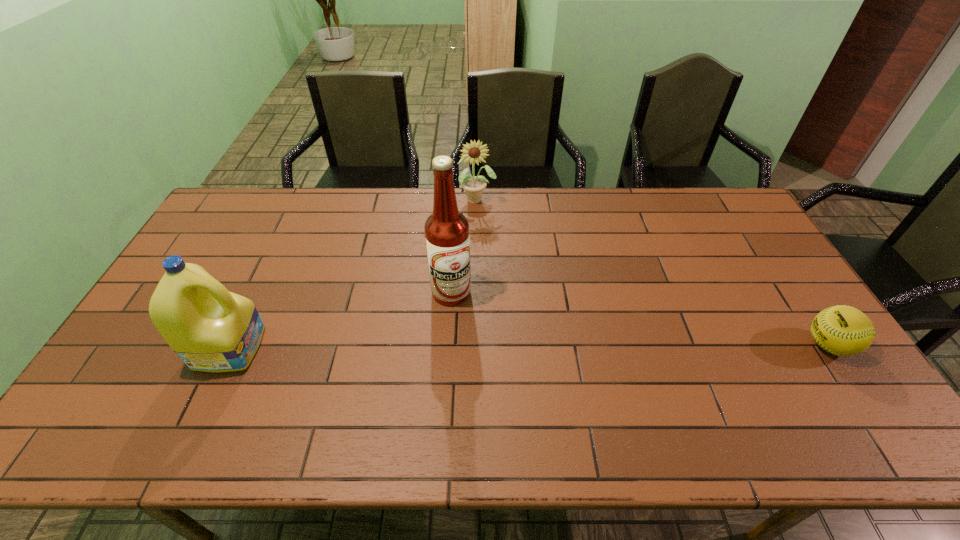
Locate an element on the screen. The height and width of the screenshot is (540, 960). object at the right edge is located at coordinates (842, 330).

You are a GUI agent. You are given a task and a screenshot of the screen. Output one action in this format:
    pyautogui.click(x=<x>, y=<y>)
    Task: Click on the free space at the far edge of the desktop
    
    Given the screenshot: What is the action you would take?
    pyautogui.click(x=356, y=194)

You are a GUI agent. You are given a task and a screenshot of the screen. Output one action in this format:
    pyautogui.click(x=<x>, y=<y>)
    Task: Click on the vacant space at the near edge of the desktop
    The height and width of the screenshot is (540, 960).
    Given the screenshot: What is the action you would take?
    pyautogui.click(x=284, y=394)

In order to click on free region at the right edge of the desktop in this screenshot , I will do `click(744, 236)`.

I want to click on vacant point located between the softball and the farthest object, so click(x=653, y=272).

This screenshot has width=960, height=540. In order to click on vacant area between the leftmost object and the third nearest object in this screenshot , I will do `click(341, 319)`.

Where is `empty space between the tallest object and the shortest object`? empty space between the tallest object and the shortest object is located at coordinates (639, 319).

Where is `free spot between the leftmost object and the alcohol`? free spot between the leftmost object and the alcohol is located at coordinates (341, 319).

This screenshot has width=960, height=540. I want to click on free space between the detergent and the softball, so click(x=529, y=346).

The height and width of the screenshot is (540, 960). Identify the location of empty location between the sunflower and the detergent. (353, 273).